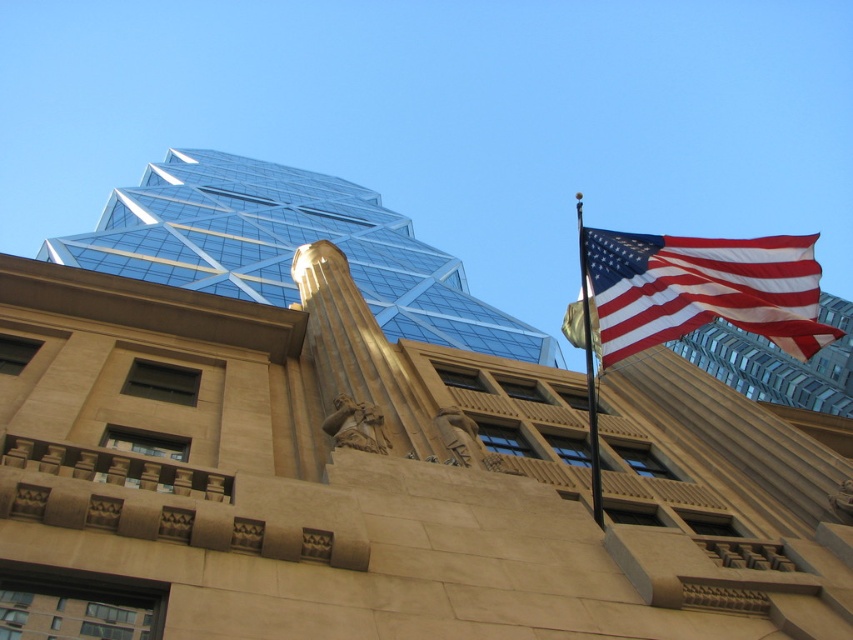
Question: Is transparent glass tower at upper center smaller than black metal flag pole at upper right?

Choices:
 (A) yes
 (B) no

Answer: (A)

Question: Does beige stone column at center come behind black metal flag pole at upper right?

Choices:
 (A) no
 (B) yes

Answer: (B)

Question: Considering the real-world distances, which object is farthest from the glassy steel tower at upper center?

Choices:
 (A) beige stone column at center
 (B) red-white-striped fabric flag at upper right
 (C) transparent glass tower at upper center

Answer: (C)

Question: Which object appears farthest from the camera in this image?

Choices:
 (A) transparent glass tower at upper center
 (B) beige stone column at center
 (C) black metal flag pole at upper right

Answer: (A)

Question: Which of these objects is positioned farthest from the black metal flag pole at upper right?

Choices:
 (A) transparent glass tower at upper center
 (B) beige stone column at center

Answer: (A)

Question: Is glassy steel tower at upper center to the right of beige stone column at center from the viewer's perspective?

Choices:
 (A) no
 (B) yes

Answer: (B)